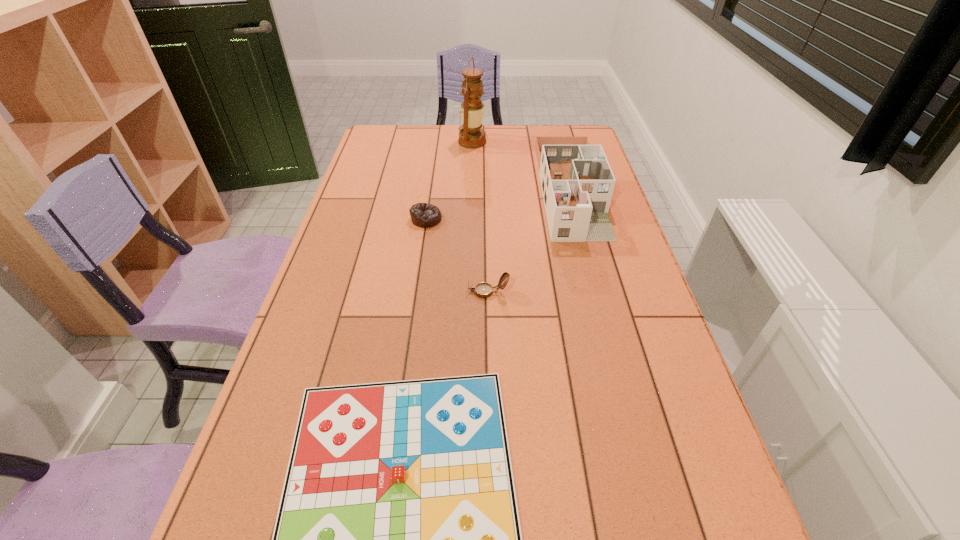
Where is `free region that satisfies the following two spatial constraints: 1. at the front door of the second tallest object; 2. on the face of the compass`? free region that satisfies the following two spatial constraints: 1. at the front door of the second tallest object; 2. on the face of the compass is located at coordinates (598, 292).

Where is `vacant area that satisfies the following two spatial constraints: 1. at the front door of the rightmost object; 2. on the face of the third shortest object`? vacant area that satisfies the following two spatial constraints: 1. at the front door of the rightmost object; 2. on the face of the third shortest object is located at coordinates (598, 292).